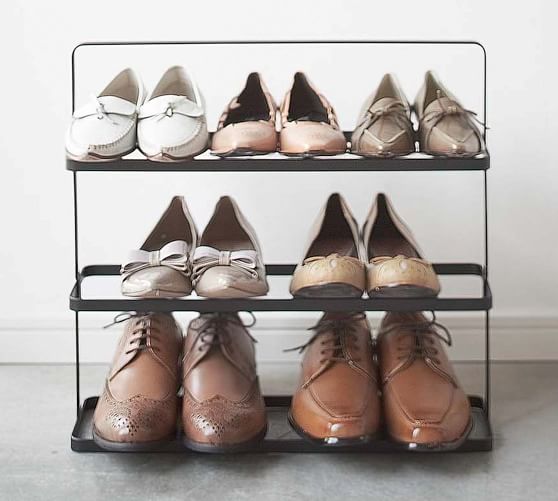
Locate an element on the screen. This screenshot has width=558, height=501. the bottom shelf shoe is located at coordinates (134, 415), (217, 406), (328, 414), (417, 416).